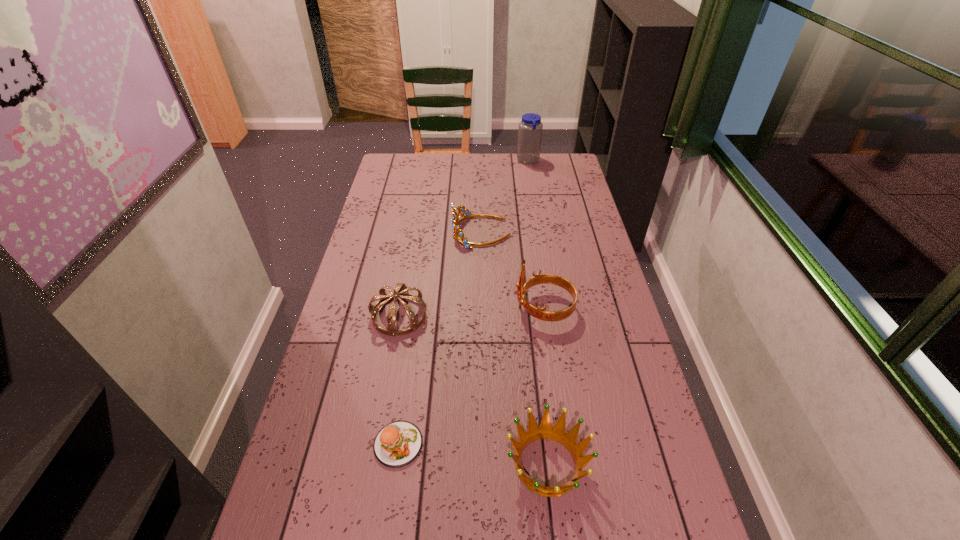
Find the location of a particular element. water bottle present at the right edge is located at coordinates (530, 128).

In order to click on tiara located at the right edge in this screenshot , I will do `click(539, 313)`.

Image resolution: width=960 pixels, height=540 pixels. Identify the location of object situated at the far right corner. (530, 128).

This screenshot has height=540, width=960. In order to click on vacant region at the far edge of the desktop in this screenshot , I will do `click(511, 160)`.

Find the location of a particular element. The height and width of the screenshot is (540, 960). vacant area at the left edge of the desktop is located at coordinates (355, 320).

Identify the location of free region at the right edge. The width and height of the screenshot is (960, 540). (564, 213).

Find the location of a particular element. The width and height of the screenshot is (960, 540). free space at the far right corner of the desktop is located at coordinates coord(553,158).

The height and width of the screenshot is (540, 960). What are the coordinates of `free space between the tallest tiara and the water bottle` in the screenshot? It's located at coord(537,234).

Locate an element on the screen. The image size is (960, 540). vacant space that's between the crown and the tallest tiara is located at coordinates (546, 386).

The image size is (960, 540). Identify the location of empty space between the shortest object and the tallest tiara. (471, 376).